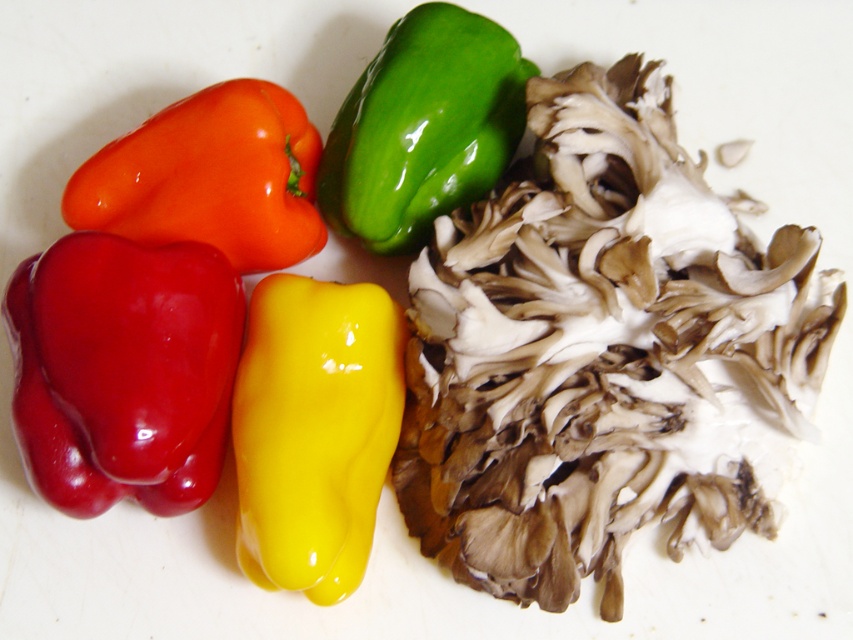
Question: Is glossy red bell pepper at lower left smaller than green glossy bell pepper at upper center?

Choices:
 (A) yes
 (B) no

Answer: (B)

Question: Which point appears farthest from the camera in this image?

Choices:
 (A) (416, 147)
 (B) (193, 388)
 (C) (250, 369)
 (D) (537, 125)

Answer: (A)

Question: Considering the relative positions of green glossy bell pepper at upper left and glossy red bell pepper at lower left in the image provided, where is green glossy bell pepper at upper left located with respect to glossy red bell pepper at lower left?

Choices:
 (A) left
 (B) right

Answer: (B)

Question: Which is farther from the green glossy bell pepper at upper left?

Choices:
 (A) green glossy bell pepper at upper center
 (B) glossy yellow pepper at center
 (C) glossy plastic bell pepper at upper left

Answer: (C)

Question: Observing the image, what is the correct spatial positioning of glossy red bell pepper at lower left in reference to glossy yellow pepper at center?

Choices:
 (A) above
 (B) below

Answer: (A)

Question: Which object is positioned closest to the glossy plastic bell pepper at upper left?

Choices:
 (A) glossy red bell pepper at lower left
 (B) green glossy bell pepper at upper left

Answer: (A)